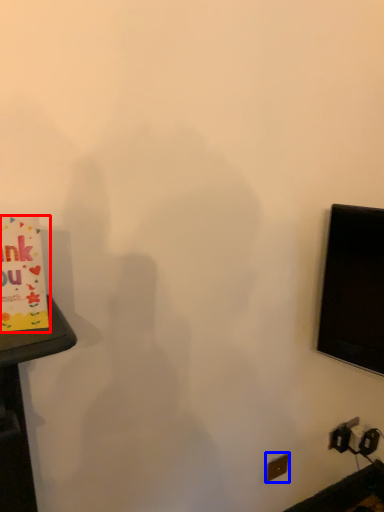
Question: Which point is further to the camera, birthday card (highlighted by a red box) or electric outlet (highlighted by a blue box)?

Choices:
 (A) birthday card
 (B) electric outlet

Answer: (B)